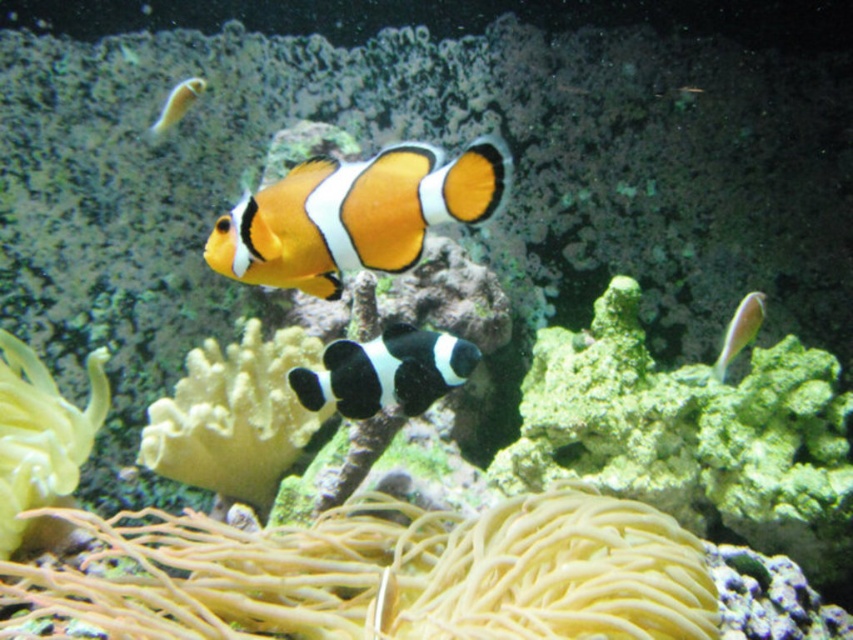
Question: Which of these objects is positioned closest to the orange and black clownfish at center?

Choices:
 (A) black matte clownfish at center
 (B) yellow soft coral at center
 (C) orange matte clownfish at upper center

Answer: (A)

Question: Which of the following is the farthest from the observer?

Choices:
 (A) pink glossy fish at right
 (B) orange and black clownfish at center
 (C) orange matte clownfish at upper center
 (D) black matte clownfish at center

Answer: (C)

Question: Does orange and black clownfish at center appear over orange matte clownfish at upper center?

Choices:
 (A) yes
 (B) no

Answer: (B)

Question: Considering the real-world distances, which object is closest to the orange matte clownfish at upper center?

Choices:
 (A) pink glossy fish at right
 (B) yellow soft coral at center
 (C) black matte clownfish at center

Answer: (B)

Question: Does black matte clownfish at center appear on the left side of pink glossy fish at right?

Choices:
 (A) yes
 (B) no

Answer: (A)

Question: Is yellow soft coral at center bigger than orange matte clownfish at upper center?

Choices:
 (A) no
 (B) yes

Answer: (B)